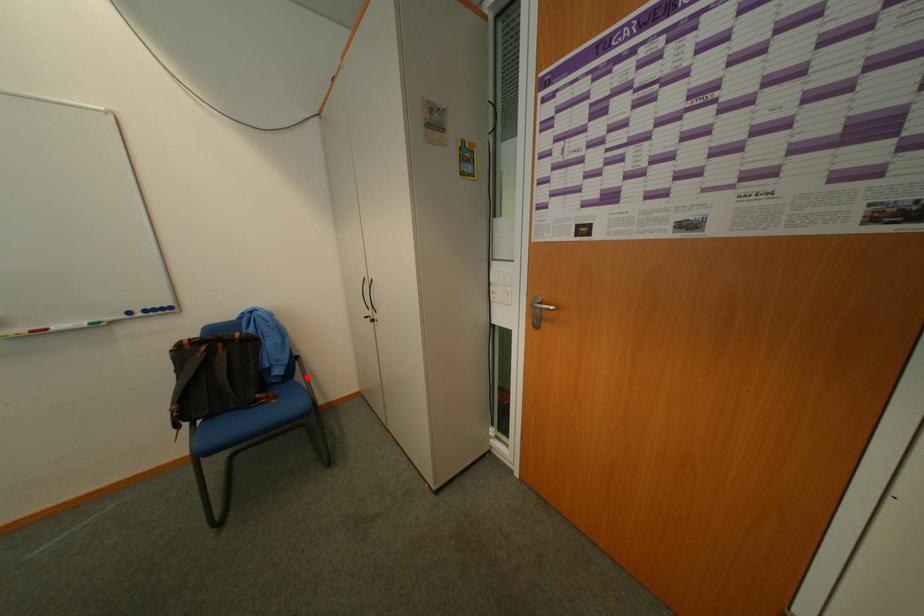
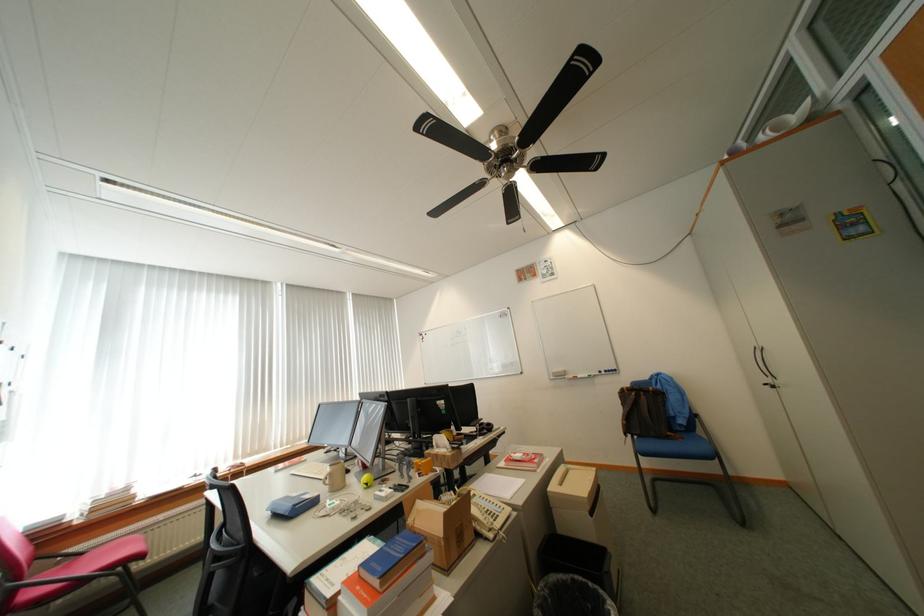
Question: I am providing you with two images of the same scene from different viewpoints. Image1 has a red point marked. In image2, the corresponding 3D location appears at what relative position? Reply with the corresponding letter.

Choices:
 (A) Closer
 (B) Farther

Answer: (B)